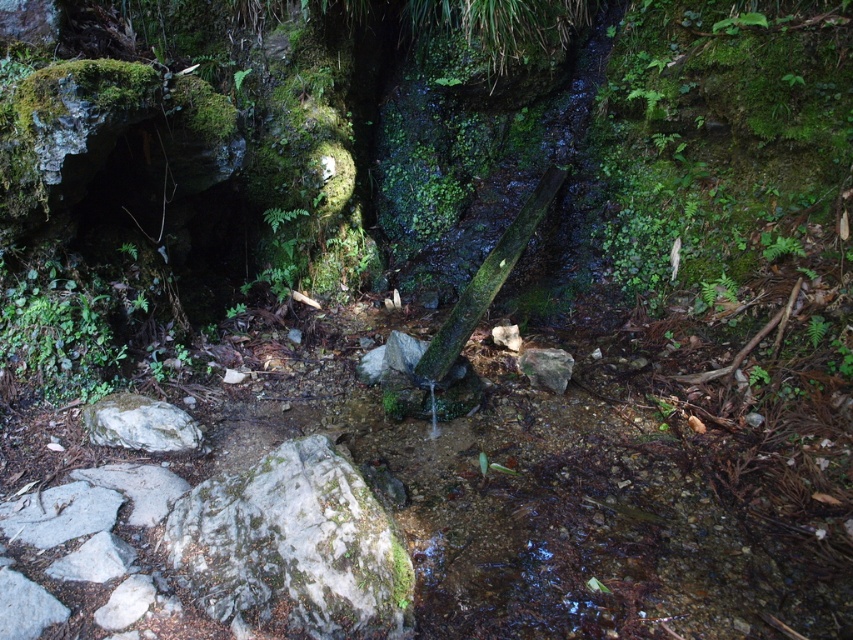
Question: Which object is farther from the camera taking this photo?

Choices:
 (A) gray rough rock at lower left
 (B) gray/rough rock at lower left
 (C) gray/mossy rock at center-left

Answer: (B)

Question: Does gray/mossy rock at center-left appear on the left side of gray/rough rock at lower left?

Choices:
 (A) yes
 (B) no

Answer: (B)

Question: Which of these objects is positioned farthest from the gray/mossy rock at center-left?

Choices:
 (A) gray rough rock at lower left
 (B) gray rough rock at center

Answer: (B)

Question: Does gray/rough rock at lower left have a larger size compared to gray rough rock at center?

Choices:
 (A) yes
 (B) no

Answer: (A)

Question: Can you confirm if gray rough rock at lower left is positioned to the left of gray rough rock at center?

Choices:
 (A) no
 (B) yes

Answer: (B)

Question: Among these objects, which one is nearest to the camera?

Choices:
 (A) gray/mossy rock at center-left
 (B) gray/rough rock at lower left
 (C) gray rough rock at lower left

Answer: (A)